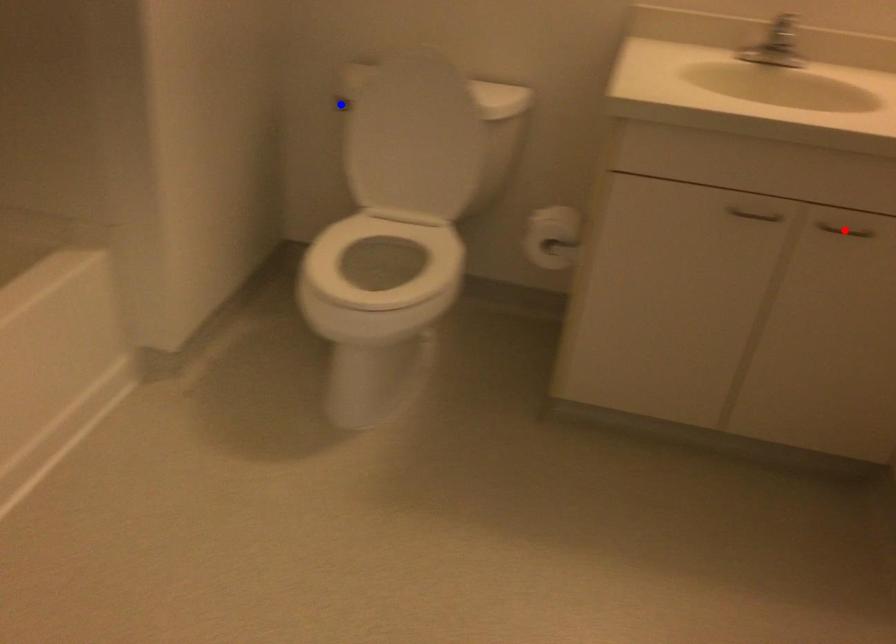
Question: In the image, two points are highlighted. Which point is nearer to the camera? Reply with the corresponding letter.

Choices:
 (A) blue point
 (B) red point

Answer: (B)